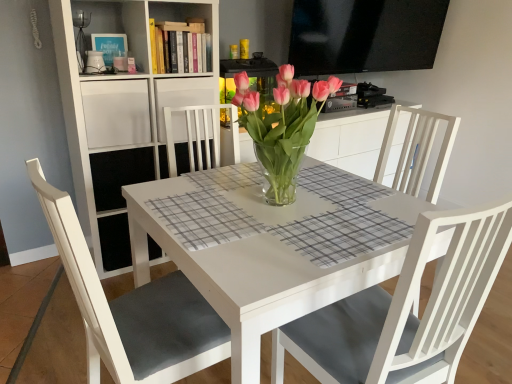
Where is `vacant space underneath pink glass vase at center (from a real-world perspective)`? vacant space underneath pink glass vase at center (from a real-world perspective) is located at coordinates (270, 201).